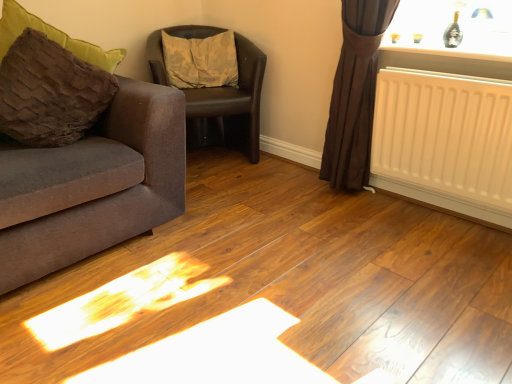
Question: Is camouflage fabric pillow at center, the first pillow positioned from the back, facing towards matte gray couch at left?

Choices:
 (A) no
 (B) yes

Answer: (A)

Question: Is camouflage fabric pillow at center, which is the first pillow from right to left, to the left of matte gray couch at left from the viewer's perspective?

Choices:
 (A) yes
 (B) no

Answer: (B)

Question: From the image's perspective, is camouflage fabric pillow at center, which is the first pillow from right to left, over matte gray couch at left?

Choices:
 (A) no
 (B) yes

Answer: (B)

Question: Does camouflage fabric pillow at center, which is the first pillow from right to left, have a lesser height compared to matte gray couch at left?

Choices:
 (A) no
 (B) yes

Answer: (B)

Question: From a real-world perspective, is camouflage fabric pillow at center, the 2th pillow viewed from the front, physically above matte gray couch at left?

Choices:
 (A) yes
 (B) no

Answer: (A)

Question: From the image's perspective, does camouflage fabric pillow at center, positioned as the 2th pillow in left-to-right order, appear lower than matte gray couch at left?

Choices:
 (A) no
 (B) yes

Answer: (A)

Question: Does matte gray couch at left appear on the left side of white matte radiator at right?

Choices:
 (A) yes
 (B) no

Answer: (A)

Question: Does matte gray couch at left have a larger size compared to white matte radiator at right?

Choices:
 (A) yes
 (B) no

Answer: (A)

Question: Would you say matte gray couch at left is outside white matte radiator at right?

Choices:
 (A) yes
 (B) no

Answer: (A)

Question: Is white matte radiator at right at the back of matte gray couch at left?

Choices:
 (A) yes
 (B) no

Answer: (B)

Question: Does matte gray couch at left have a greater height compared to white matte radiator at right?

Choices:
 (A) yes
 (B) no

Answer: (A)

Question: Considering the relative sizes of matte gray couch at left and white matte radiator at right in the image provided, is matte gray couch at left shorter than white matte radiator at right?

Choices:
 (A) no
 (B) yes

Answer: (A)

Question: Considering the relative positions of brown leather chair at center and brown fuzzy pillow at left, which ranks as the second pillow in right-to-left order, in the image provided, is brown leather chair at center behind brown fuzzy pillow at left, which ranks as the second pillow in right-to-left order,?

Choices:
 (A) no
 (B) yes

Answer: (B)